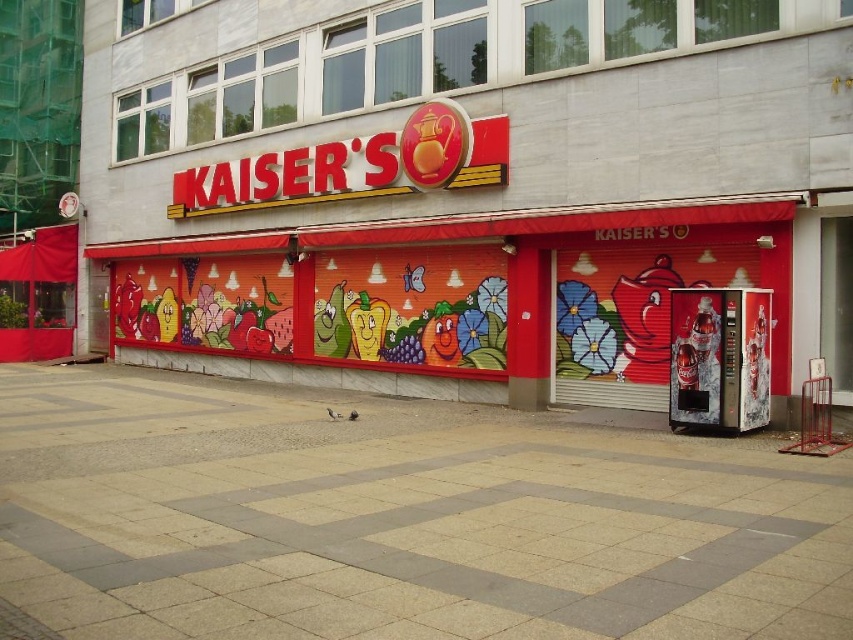
Consider the image. You are a customer standing on the gray concrete pavement at center and want to reach the top of the matte red vending machine at center right. Can you climb onto the vending machine from the pavement?

The matte red vending machine at center right is taller than the gray concrete pavement at center, so you can climb onto the vending machine from the pavement since it is elevated above the pavement.

You are standing at the entrance of Kaiser cafe and want to buy a drink. Where is the matte red vending machine at center right located?

The matte red vending machine at center right is located at point (471, 188).